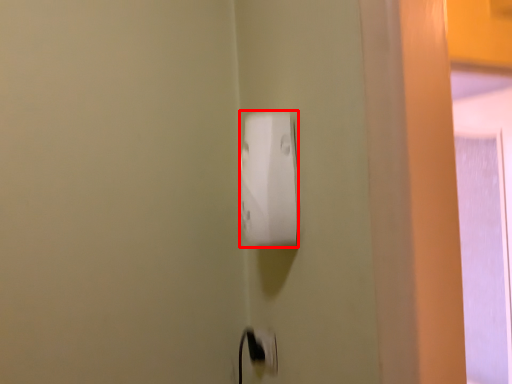
Question: From the image, what is the correct spatial relationship of power plugs and sockets (annotated by the red box) in relation to electric outlet?

Choices:
 (A) left
 (B) right

Answer: (A)